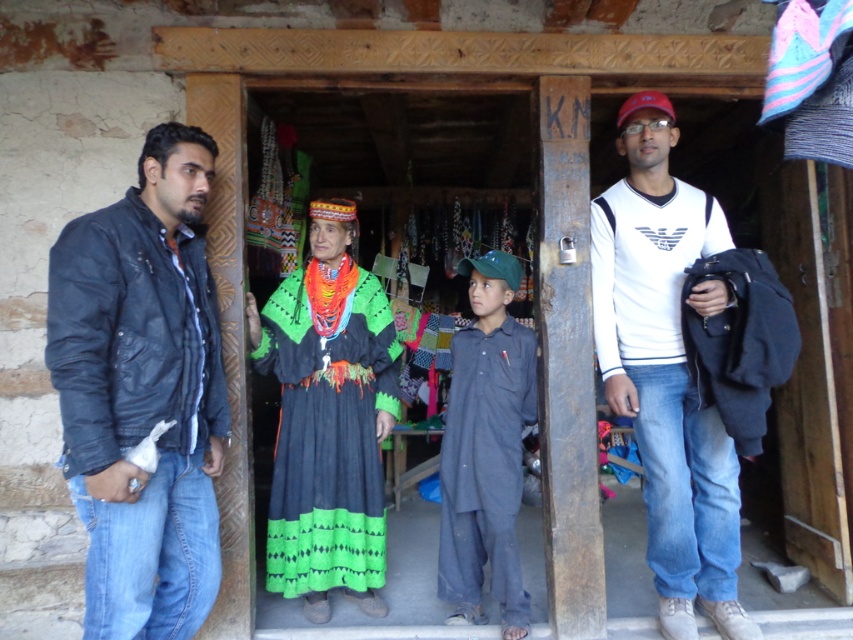
Between point (308, 556) and point (439, 579), which one is positioned behind?

Point (439, 579)

Who is higher up, multicolored woven dress at center or dark blue cotton shirt at center?

multicolored woven dress at center is higher up.

Find the location of a particular element. multicolored woven dress at center is located at coordinates pyautogui.click(x=328, y=438).

Can you confirm if white cotton t-shirt at center is thinner than multicolored woven dress at center?

No, white cotton t-shirt at center is not thinner than multicolored woven dress at center.

Is white cotton t-shirt at center wider than multicolored woven dress at center?

Indeed, white cotton t-shirt at center has a greater width compared to multicolored woven dress at center.

Does point (691, 618) come closer to viewer compared to point (335, 458)?

Yes, point (691, 618) is closer to viewer.

Find the location of a particular element. white cotton t-shirt at center is located at coordinates (666, 371).

Who is higher up, leather jacket at left or multicolored woven dress at center?

leather jacket at left

Is leather jacket at left shorter than multicolored woven dress at center?

No, leather jacket at left is not shorter than multicolored woven dress at center.

Does point (59, 298) lie behind point (346, 522)?

That is False.

Where is `leather jacket at left`? The width and height of the screenshot is (853, 640). leather jacket at left is located at coordinates (142, 392).